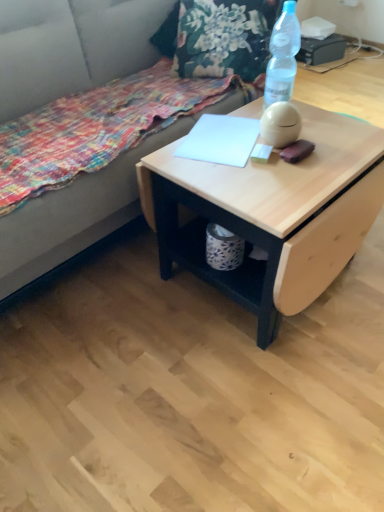
Question: Is transparent plastic bottle at upper right surrounding floral fabric blanket at lower left?

Choices:
 (A) yes
 (B) no

Answer: (B)

Question: From a real-world perspective, is transparent plastic bottle at upper right on floral fabric blanket at lower left?

Choices:
 (A) no
 (B) yes

Answer: (B)

Question: Is transparent plastic bottle at upper right oriented away from floral fabric blanket at lower left?

Choices:
 (A) no
 (B) yes

Answer: (A)

Question: From the image's perspective, is transparent plastic bottle at upper right beneath floral fabric blanket at lower left?

Choices:
 (A) yes
 (B) no

Answer: (B)

Question: Is transparent plastic bottle at upper right beside floral fabric blanket at lower left?

Choices:
 (A) yes
 (B) no

Answer: (B)

Question: Relative to floral fabric blanket at lower left, is transparent plastic bottle at upper right in front or behind?

Choices:
 (A) front
 (B) behind

Answer: (B)

Question: From the image's perspective, relative to floral fabric blanket at lower left, is transparent plastic bottle at upper right above or below?

Choices:
 (A) above
 (B) below

Answer: (A)

Question: Considering the positions of transparent plastic bottle at upper right and floral fabric blanket at lower left in the image, is transparent plastic bottle at upper right bigger or smaller than floral fabric blanket at lower left?

Choices:
 (A) big
 (B) small

Answer: (B)

Question: From their relative heights in the image, would you say transparent plastic bottle at upper right is taller or shorter than floral fabric blanket at lower left?

Choices:
 (A) short
 (B) tall

Answer: (B)

Question: Considering their positions, is white paper at center located in front of or behind transparent plastic bottle at upper right?

Choices:
 (A) front
 (B) behind

Answer: (B)

Question: Visually, is white paper at center positioned to the left or to the right of transparent plastic bottle at upper right?

Choices:
 (A) right
 (B) left

Answer: (B)

Question: Considering the positions of white paper at center and transparent plastic bottle at upper right in the image, is white paper at center wider or thinner than transparent plastic bottle at upper right?

Choices:
 (A) wide
 (B) thin

Answer: (A)

Question: From their relative heights in the image, would you say white paper at center is taller or shorter than transparent plastic bottle at upper right?

Choices:
 (A) tall
 (B) short

Answer: (B)

Question: Considering their positions, is fabric couch at upper left located in front of or behind white paper at center?

Choices:
 (A) behind
 (B) front

Answer: (B)

Question: From a real-world perspective, is fabric couch at upper left physically located above or below white paper at center?

Choices:
 (A) above
 (B) below

Answer: (B)